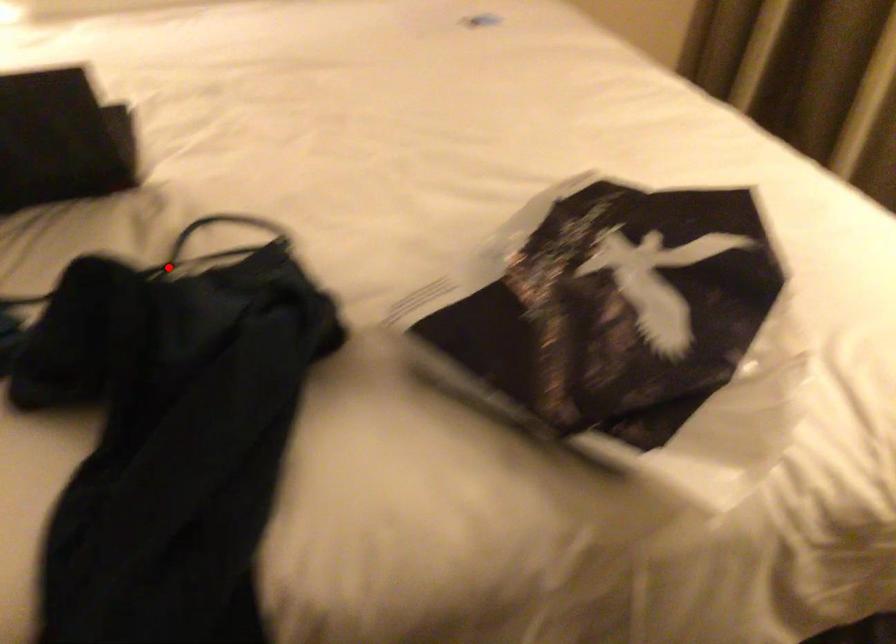
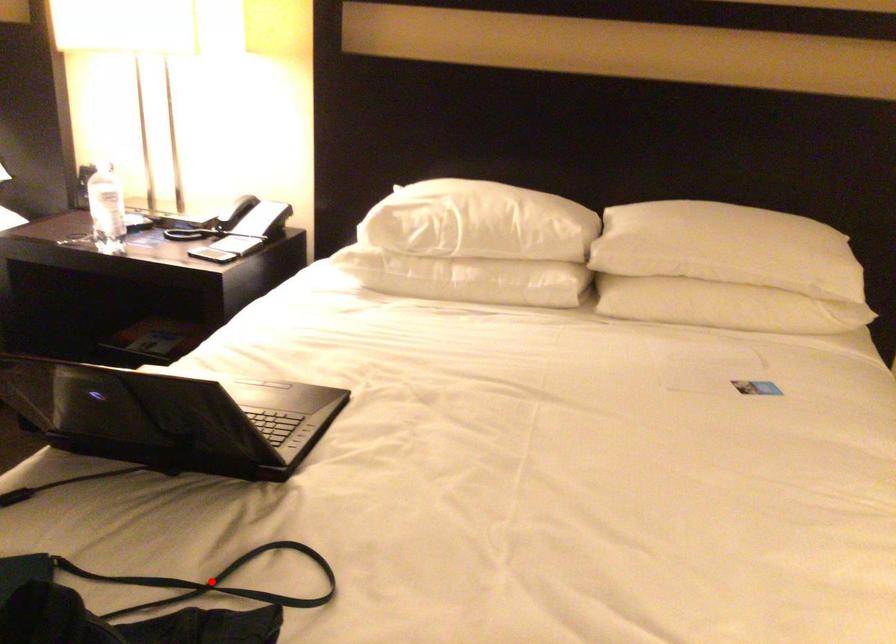
I am providing you with two images of the same scene from different viewpoints. A red point is marked on the first image and another point is marked on the second image. Does the point marked in image1 correspond to the same location as the one in image2?

Yes